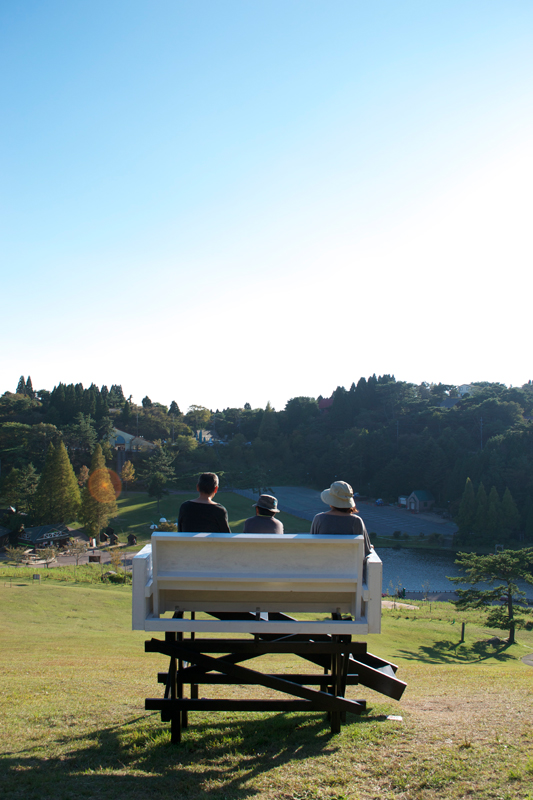
Find the location of a particular element. place to sit is located at coordinates (279, 570).